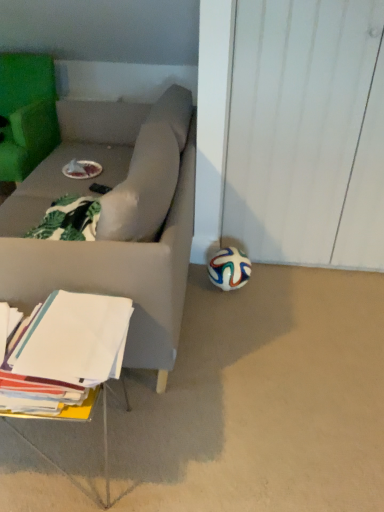
Question: From the image's perspective, relative to multicolored rubber ball at lower right, is white paper at lower left above or below?

Choices:
 (A) below
 (B) above

Answer: (A)

Question: From their relative heights in the image, would you say white paper at lower left is taller or shorter than multicolored rubber ball at lower right?

Choices:
 (A) tall
 (B) short

Answer: (A)

Question: Which object is positioned farthest from the white matte soccer ball at lower right?

Choices:
 (A) green fabric chair at upper left
 (B) multicolored rubber ball at lower right
 (C) white paper at lower left

Answer: (A)

Question: Estimate the real-world distances between objects in this image. Which object is closer to the white paper at lower left?

Choices:
 (A) multicolored rubber ball at lower right
 (B) green fabric chair at upper left
 (C) white matte soccer ball at lower right

Answer: (C)